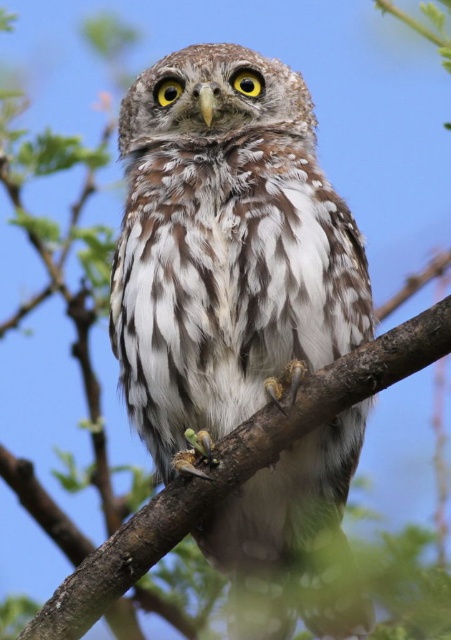
You are a photographer trying to capture the brown feathered owl at center and the brown textured branch at center in a single frame. Based on their widths, which object will appear narrower in the photo?

The brown feathered owl at center has a lesser width compared to the brown textured branch at center, so it will appear narrower in the photo.

You are a photographer trying to capture the owl in the image. The owl is at point (225,248). If you want to position the owl exactly at the center of the frame, which direction should you move the camera? Please provide your answer in terms of coordinates relative to the current position.

The brown feathered owl at center is located at point (225,248). To center it, move the camera so the owl moves to the exact center coordinates, which would require adjusting the position based on the current offset from the center.

You are a birdwatcher observing the brown feathered owl at center and the brown textured branch at center. Which object is closer to your eyes?

The brown feathered owl at center is closer to your eyes because it is positioned further to the viewer than the brown textured branch at center.